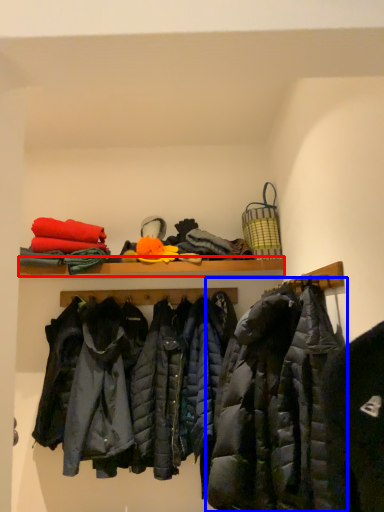
Question: Which point is further to the camera, shelf (highlighted by a red box) or jacket (highlighted by a blue box)?

Choices:
 (A) shelf
 (B) jacket

Answer: (A)